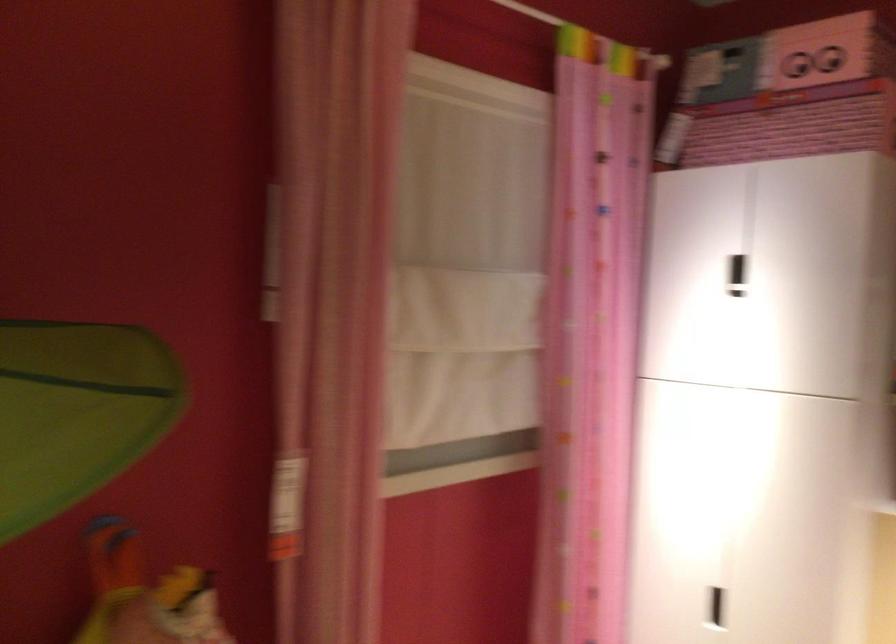
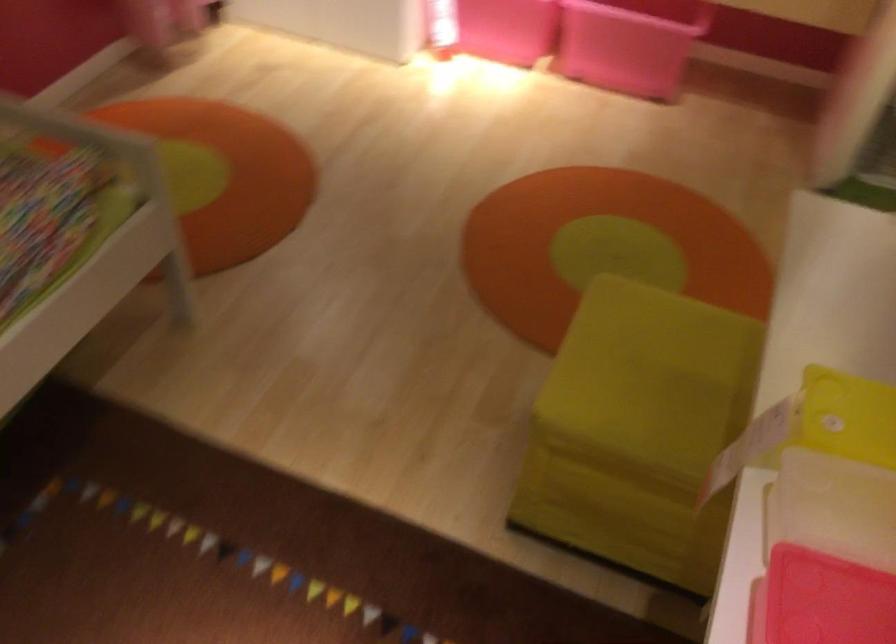
The first image is from the beginning of the video and the second image is from the end. How did the camera likely rotate when shooting the video?

The rotation direction of the camera is right-down.